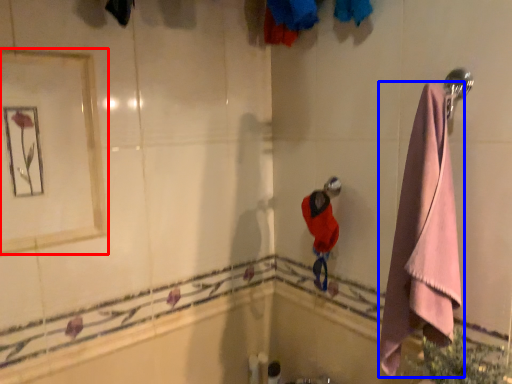
Question: Which object is further to the camera taking this photo, mirror (highlighted by a red box) or towel (highlighted by a blue box)?

Choices:
 (A) mirror
 (B) towel

Answer: (A)